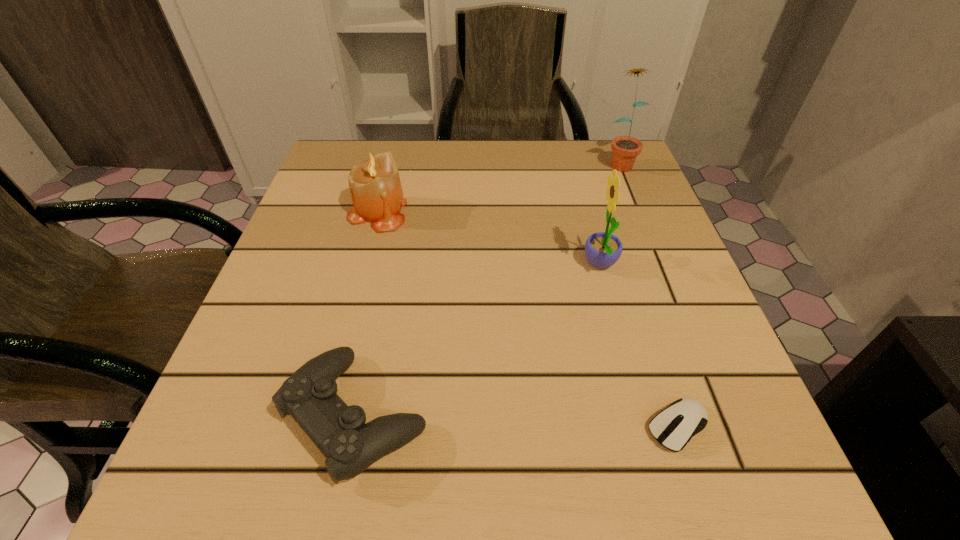
Where is `vacant region between the third farthest object and the shortest object`? The width and height of the screenshot is (960, 540). vacant region between the third farthest object and the shortest object is located at coordinates (639, 346).

What are the coordinates of `free point between the second farthest object and the shortest object` in the screenshot? It's located at (528, 319).

Point out which object is positioned as the third nearest to the farther sunflower. Please provide its 2D coordinates. Your answer should be formatted as a tuple, i.e. [(x, y)], where the tuple contains the x and y coordinates of a point satisfying the conditions above.

[(673, 427)]

Identify the location of object that is the closest to the third nearest object. The image size is (960, 540). (673, 427).

The width and height of the screenshot is (960, 540). Find the location of `vacant point that satisfies the following two spatial constraints: 1. on the front-facing side of the shortest object; 2. on the left side of the third farthest object`. vacant point that satisfies the following two spatial constraints: 1. on the front-facing side of the shortest object; 2. on the left side of the third farthest object is located at coordinates (644, 427).

Where is `vacant space that satisfies the following two spatial constraints: 1. on the flower of the right sunflower; 2. on the front-facing side of the third nearest object`? The height and width of the screenshot is (540, 960). vacant space that satisfies the following two spatial constraints: 1. on the flower of the right sunflower; 2. on the front-facing side of the third nearest object is located at coordinates (661, 265).

The width and height of the screenshot is (960, 540). I want to click on blank space that satisfies the following two spatial constraints: 1. on the front side of the shortest object; 2. on the right side of the control, so click(x=353, y=427).

The height and width of the screenshot is (540, 960). Find the location of `free point that satisfies the following two spatial constraints: 1. on the front side of the third tallest object; 2. on the left side of the shortest object`. free point that satisfies the following two spatial constraints: 1. on the front side of the third tallest object; 2. on the left side of the shortest object is located at coordinates (322, 427).